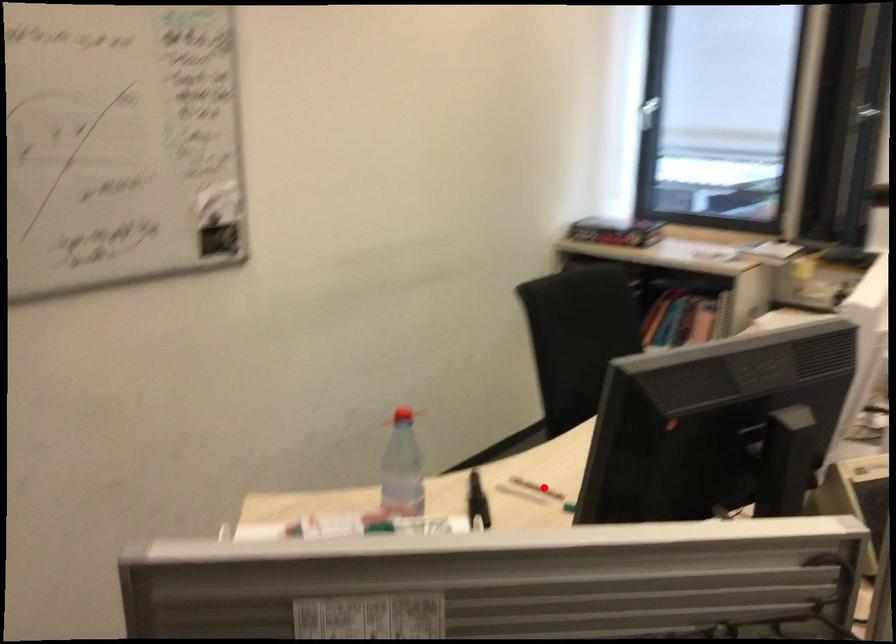
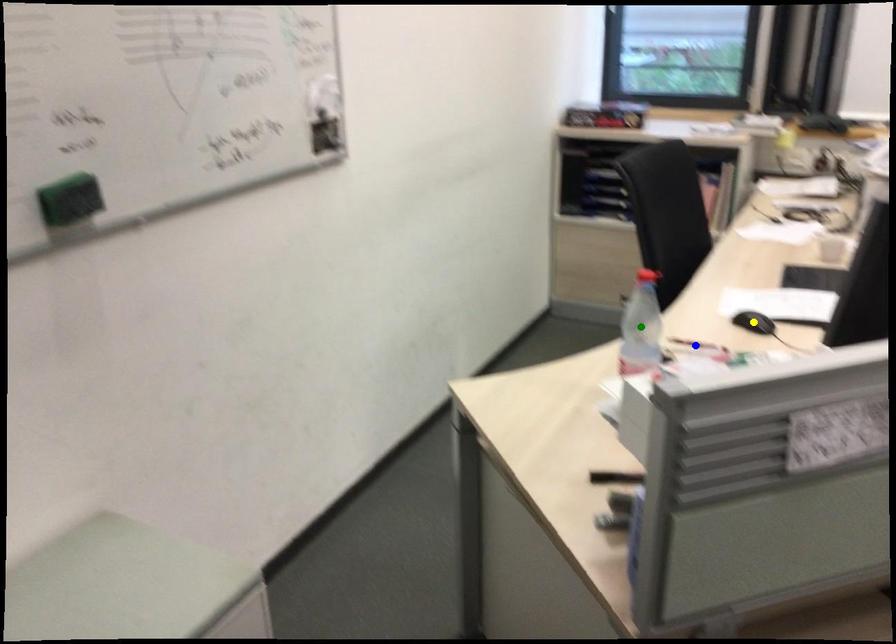
Question: I am providing you with two images of the same scene from different viewpoints. A red point is marked on the first image. You are given multiple points on the second image. Can you choose the point in image 2 that corresponds to the point in image 1?

Choices:
 (A) blue point
 (B) yellow point
 (C) green point

Answer: (A)